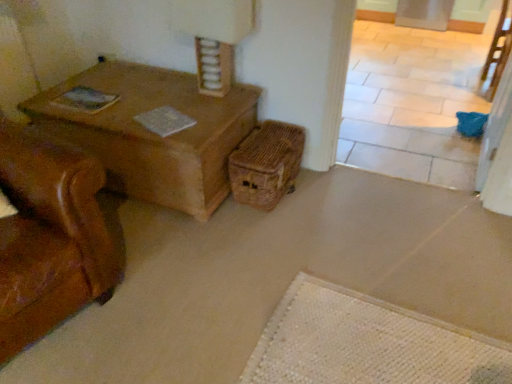
You are a GUI agent. You are given a task and a screenshot of the screen. Output one action in this format:
    pyautogui.click(x=<x>, y=<y>)
    Task: Click on the free spot below brown woven chair at upper right (from a real-world perspective)
    The image size is (512, 384).
    Given the screenshot: What is the action you would take?
    pyautogui.click(x=483, y=96)